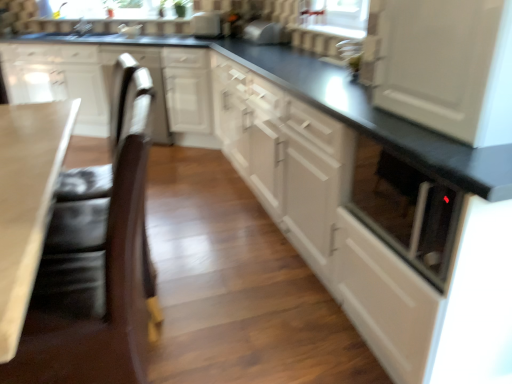
Question: Does smooth beige countertop at lower left come behind white glossy cabinet at left, which ranks as the 1th cabinetry in left-to-right order?

Choices:
 (A) yes
 (B) no

Answer: (B)

Question: Is smooth beige countertop at lower left thinner than white glossy cabinet at left, the 4th cabinetry from the right?

Choices:
 (A) no
 (B) yes

Answer: (B)

Question: Considering the relative sizes of smooth beige countertop at lower left and white glossy cabinet at left, which ranks as the 1th cabinetry in left-to-right order, in the image provided, is smooth beige countertop at lower left shorter than white glossy cabinet at left, which ranks as the 1th cabinetry in left-to-right order,?

Choices:
 (A) no
 (B) yes

Answer: (B)

Question: Is smooth beige countertop at lower left facing away from white glossy cabinet at left, which ranks as the 1th cabinetry in left-to-right order?

Choices:
 (A) no
 (B) yes

Answer: (A)

Question: Considering the relative positions of smooth beige countertop at lower left and white glossy cabinet at left, which ranks as the 1th cabinetry in left-to-right order, in the image provided, is smooth beige countertop at lower left to the left of white glossy cabinet at left, which ranks as the 1th cabinetry in left-to-right order, from the viewer's perspective?

Choices:
 (A) no
 (B) yes

Answer: (A)

Question: Considering the relative positions of smooth beige countertop at lower left and brown leather swivel chair at left, which is counted as the second swivel chair, starting from the back, in the image provided, is smooth beige countertop at lower left to the left or to the right of brown leather swivel chair at left, which is counted as the second swivel chair, starting from the back,?

Choices:
 (A) left
 (B) right

Answer: (A)

Question: In the image, is smooth beige countertop at lower left positioned in front of or behind brown leather swivel chair at left, which is counted as the second swivel chair, starting from the back?

Choices:
 (A) front
 (B) behind

Answer: (A)

Question: Is point (20, 198) closer or farther from the camera than point (143, 309)?

Choices:
 (A) farther
 (B) closer

Answer: (B)

Question: From the image's perspective, is smooth beige countertop at lower left located above or below brown leather swivel chair at left, the 1th swivel chair viewed from the front?

Choices:
 (A) above
 (B) below

Answer: (A)

Question: Is brown leather swivel chair at left, which is counted as the second swivel chair, starting from the back, situated inside satin silver toaster at upper center, placed as the 1th appliance when sorted from front to back, or outside?

Choices:
 (A) inside
 (B) outside

Answer: (B)

Question: From the image's perspective, is brown leather swivel chair at left, which is counted as the second swivel chair, starting from the back, located above or below satin silver toaster at upper center, placed as the 1th appliance when sorted from front to back?

Choices:
 (A) above
 (B) below

Answer: (B)

Question: From a real-world perspective, is brown leather swivel chair at left, which is counted as the second swivel chair, starting from the back, above or below satin silver toaster at upper center, placed as the 2th appliance when sorted from back to front?

Choices:
 (A) below
 (B) above

Answer: (A)

Question: Considering the positions of brown leather swivel chair at left, the 1th swivel chair viewed from the front, and satin silver toaster at upper center, which ranks as the 2th appliance in left-to-right order, in the image, is brown leather swivel chair at left, the 1th swivel chair viewed from the front, bigger or smaller than satin silver toaster at upper center, which ranks as the 2th appliance in left-to-right order,?

Choices:
 (A) small
 (B) big

Answer: (B)

Question: From the image's perspective, is white glossy cabinet at center, the first cabinetry in the right-to-left sequence, positioned above or below smooth beige countertop at lower left?

Choices:
 (A) above
 (B) below

Answer: (A)

Question: In terms of width, does white glossy cabinet at center, the fourth cabinetry from the left, look wider or thinner when compared to smooth beige countertop at lower left?

Choices:
 (A) wide
 (B) thin

Answer: (A)